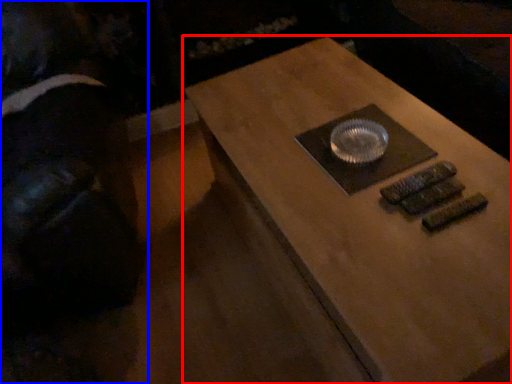
Question: Which object is closer to the camera taking this photo, table (highlighted by a red box) or person (highlighted by a blue box)?

Choices:
 (A) table
 (B) person

Answer: (A)